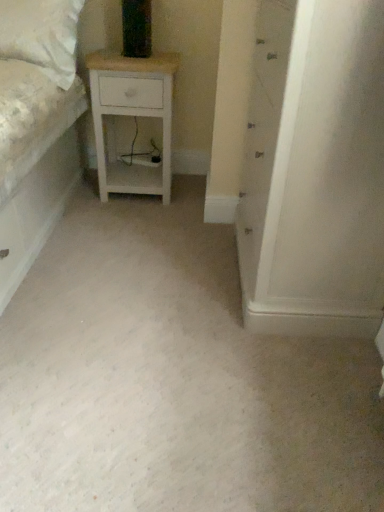
Locate an element on the screen. This screenshot has width=384, height=512. free space in front of white wood nightstand at center is located at coordinates (139, 219).